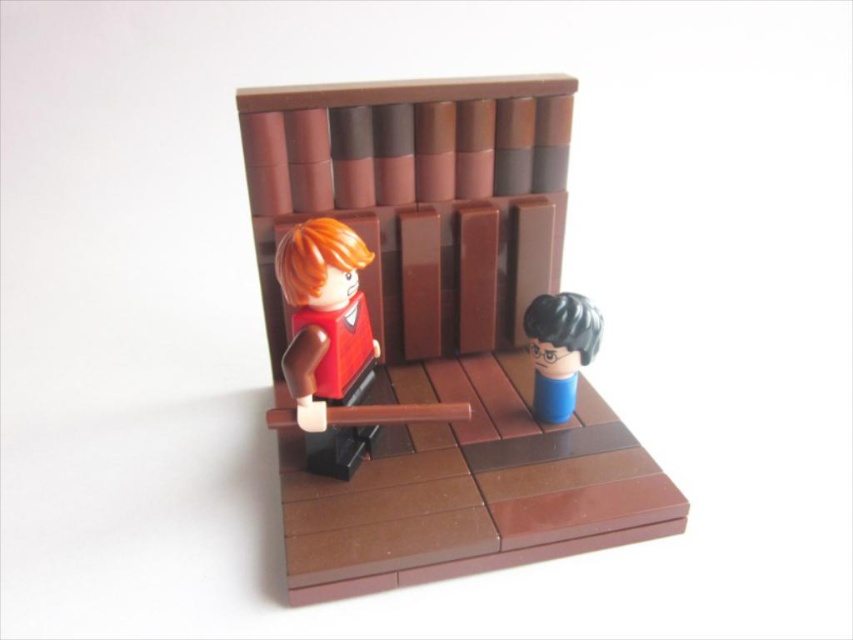
Question: Does smooth red shirt at center have a smaller size compared to matte orange hair at left?

Choices:
 (A) yes
 (B) no

Answer: (B)

Question: Which of the following is the farthest from the observer?

Choices:
 (A) (296, 417)
 (B) (532, 228)

Answer: (B)

Question: Estimate the real-world distances between objects in this image. Which object is closer to the matte orange hair at left?

Choices:
 (A) blue matte head at center
 (B) smooth red shirt at center

Answer: (B)

Question: Among these points, which one is nearest to the camera?

Choices:
 (A) (312, 420)
 (B) (576, 333)

Answer: (A)

Question: From the image, what is the correct spatial relationship of matte orange hair at left in relation to blue matte head at center?

Choices:
 (A) above
 (B) below

Answer: (A)

Question: Does smooth red shirt at center have a larger size compared to matte orange hair at left?

Choices:
 (A) no
 (B) yes

Answer: (B)